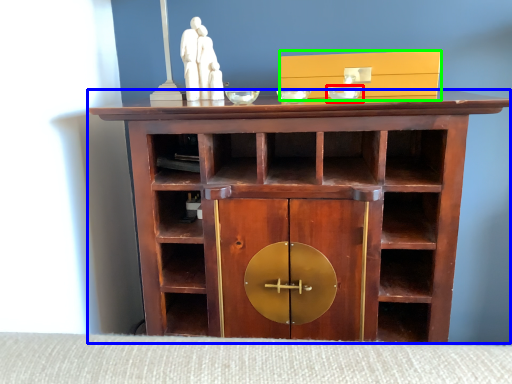
Question: Based on their relative distances, which object is farther from glass bowl (highlighted by a red box)? Choose from shelf (highlighted by a blue box) and cabinetry (highlighted by a green box).

Choices:
 (A) shelf
 (B) cabinetry

Answer: (A)